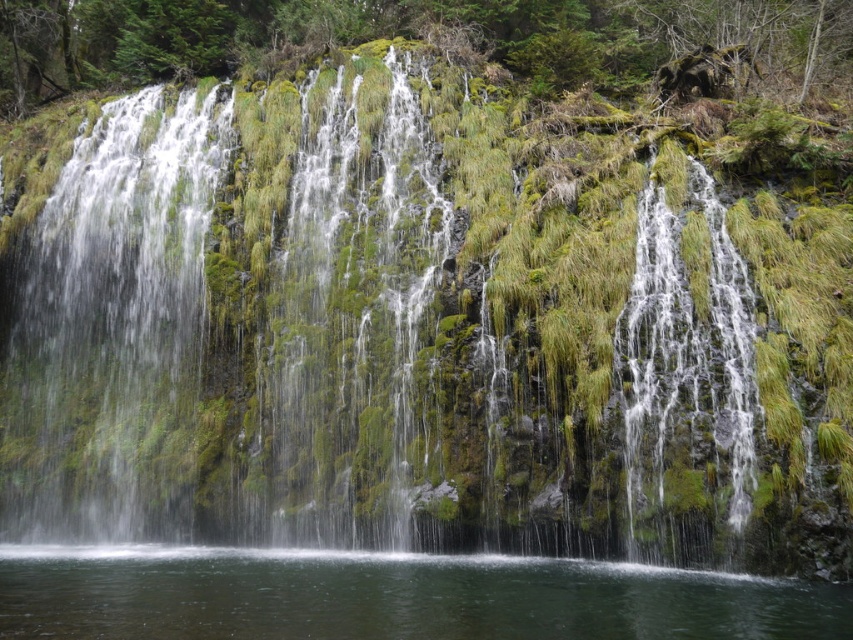
Between green mossy rock at center and clear water at center, which one is positioned higher?

green mossy rock at center is higher up.

Is green mossy rock at center taller than clear water at center?

Yes, green mossy rock at center is taller than clear water at center.

Does point (273, 282) come closer to viewer compared to point (0, 600)?

No, it is not.

Find the location of a particular element. The height and width of the screenshot is (640, 853). green mossy rock at center is located at coordinates (350, 342).

Can you confirm if clear water at center is bigger than green mossy waterfall at right?

No, clear water at center is not bigger than green mossy waterfall at right.

Who is lower down, clear water at center or green mossy waterfall at right?

clear water at center is below.

Who is more distant from viewer, (303,609) or (651,259)?

Point (651,259)

Find the location of a particular element. Image resolution: width=853 pixels, height=640 pixels. clear water at center is located at coordinates (392, 596).

Who is lower down, green mossy rock at center or green mossy waterfall at right?

green mossy waterfall at right is lower down.

Does green mossy rock at center have a lesser width compared to green mossy waterfall at right?

In fact, green mossy rock at center might be wider than green mossy waterfall at right.

Does point (312, 531) come closer to viewer compared to point (656, 428)?

No, (312, 531) is further to viewer.

The width and height of the screenshot is (853, 640). Find the location of `green mossy rock at center`. green mossy rock at center is located at coordinates (350, 342).